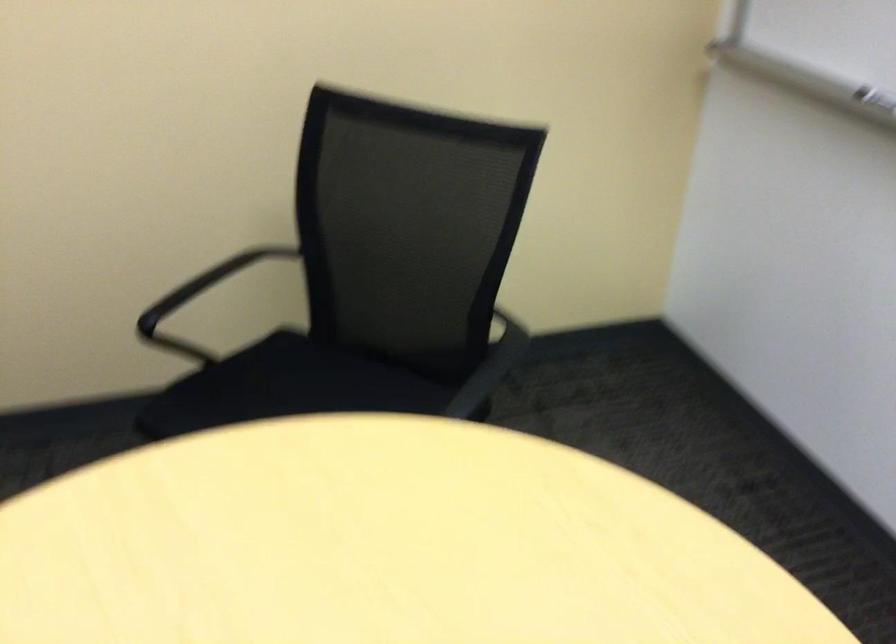
Where is `chair sitting surface`? The height and width of the screenshot is (644, 896). chair sitting surface is located at coordinates (231, 402).